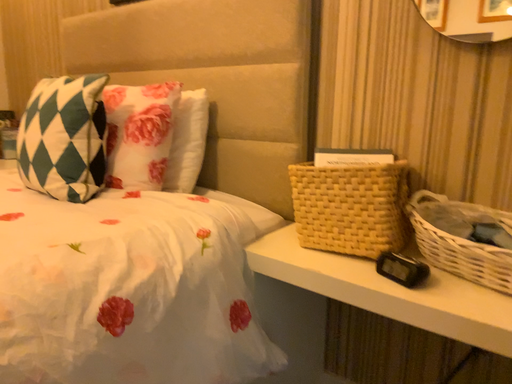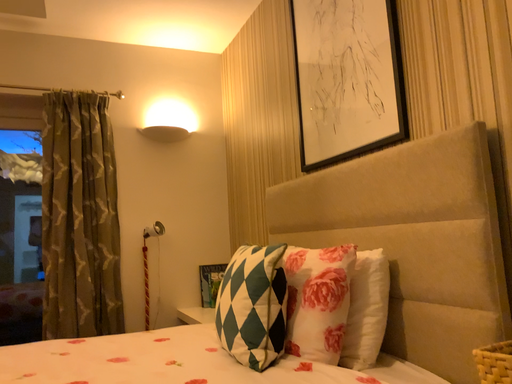
Question: Which way did the camera rotate in the video?

Choices:
 (A) rotated right
 (B) rotated left

Answer: (B)